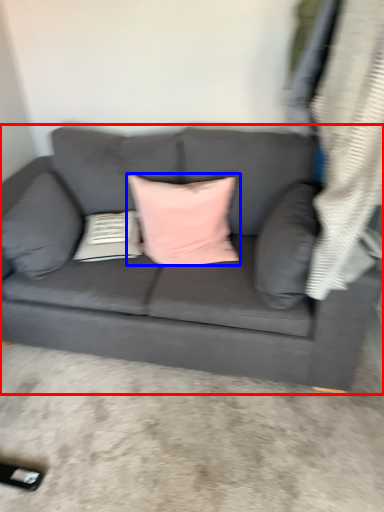
Question: Among these objects, which one is nearest to the camera, studio couch (highlighted by a red box) or pillow (highlighted by a blue box)?

Choices:
 (A) studio couch
 (B) pillow

Answer: (A)